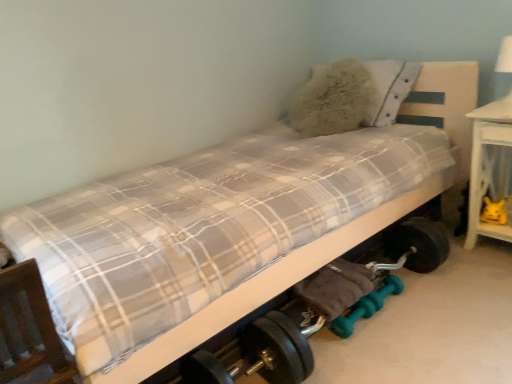
Locate an element on the screen. free space between white wood table at right and teal rubber dumbbells at lower center is located at coordinates (441, 297).